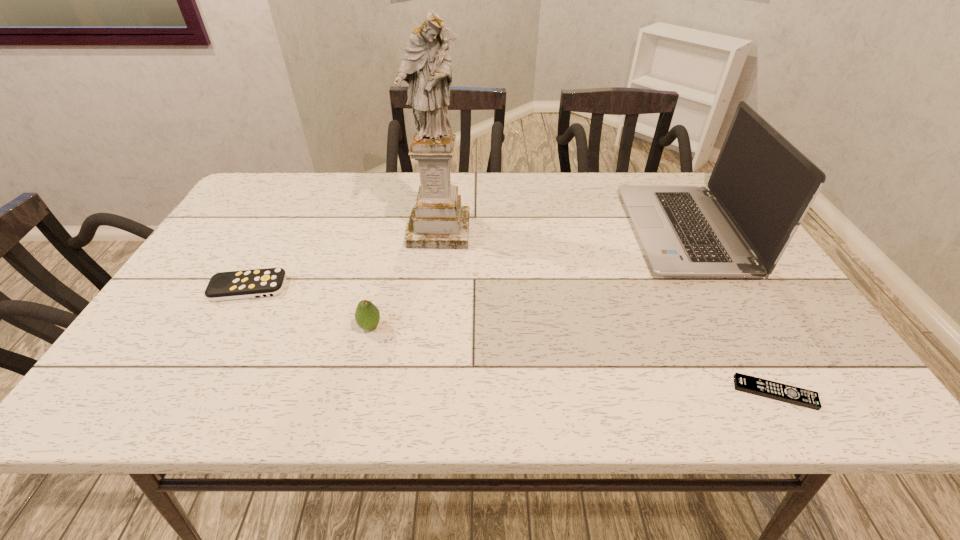
You are a GUI agent. You are given a task and a screenshot of the screen. Output one action in this format:
    pyautogui.click(x=<x>, y=<y>)
    Task: Click on the free point between the right remote control and the leftmost object
    This screenshot has height=540, width=960.
    Given the screenshot: What is the action you would take?
    pyautogui.click(x=512, y=340)

Where is `vacant area that lies between the third object from right to left and the fourth object from right to left`? vacant area that lies between the third object from right to left and the fourth object from right to left is located at coordinates (404, 279).

At what (x,y) coordinates should I click in order to perform the action: click on vacant area that lies between the fourth tallest object and the laptop computer. Please return your answer as a coordinate pair (x, y). Image resolution: width=960 pixels, height=540 pixels. Looking at the image, I should click on (466, 259).

Where is `vacant area that lies between the leftmost object and the right remote control`? The height and width of the screenshot is (540, 960). vacant area that lies between the leftmost object and the right remote control is located at coordinates (512, 340).

I want to click on free space between the third object from left to right and the right remote control, so click(607, 312).

Locate an element on the screen. The width and height of the screenshot is (960, 540). vacant space in between the shortest object and the left remote control is located at coordinates (512, 340).

I want to click on vacant area that lies between the nearer remote control and the second tallest object, so click(x=729, y=312).

The image size is (960, 540). What are the coordinates of `vacant point located between the laptop computer and the fourth tallest object` in the screenshot? It's located at (466, 259).

Locate an element on the screen. The height and width of the screenshot is (540, 960). unoccupied area between the tallest object and the leftmost object is located at coordinates click(x=344, y=259).

At what (x,y) coordinates should I click in order to perform the action: click on the third closest object to the fourth shortest object. Please return your answer as a coordinate pair (x, y). The image size is (960, 540). Looking at the image, I should click on (367, 315).